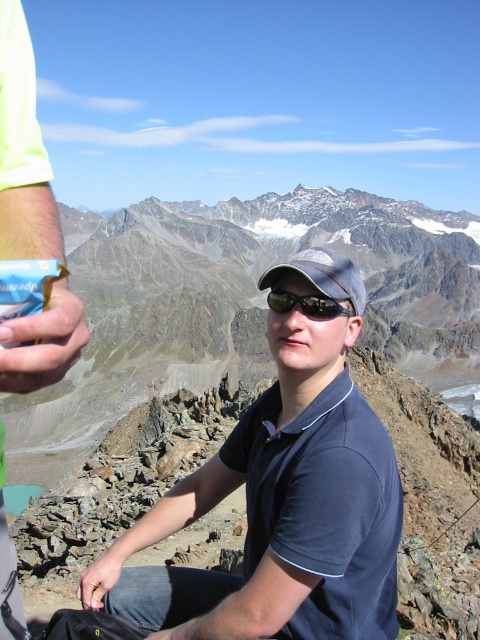
Is gray rocky mountain at center above dark gray fabric baseball cap at center?

Yes, gray rocky mountain at center is above dark gray fabric baseball cap at center.

Can you confirm if gray rocky mountain at center is positioned below dark gray fabric baseball cap at center?

Actually, gray rocky mountain at center is above dark gray fabric baseball cap at center.

Identify the location of gray rocky mountain at center. (243, 301).

The image size is (480, 640). I want to click on gray rocky mountain at center, so click(243, 301).

In the scene shown: Between gray rocky mountain at center and dark blue shirt at center, which one has more height?

gray rocky mountain at center is taller.

Who is more forward, (46,435) or (228,584)?

Point (228,584) is in front.

Find the location of a particular element. The width and height of the screenshot is (480, 640). gray rocky mountain at center is located at coordinates click(x=243, y=301).

Who is positioned more to the left, dark gray fabric baseball cap at center or black reflective sunglasses at center?

black reflective sunglasses at center

Does dark gray fabric baseball cap at center have a lesser width compared to black reflective sunglasses at center?

Incorrect, dark gray fabric baseball cap at center's width is not less than black reflective sunglasses at center's.

Identify the location of dark gray fabric baseball cap at center. (323, 275).

I want to click on dark gray fabric baseball cap at center, so click(x=323, y=275).